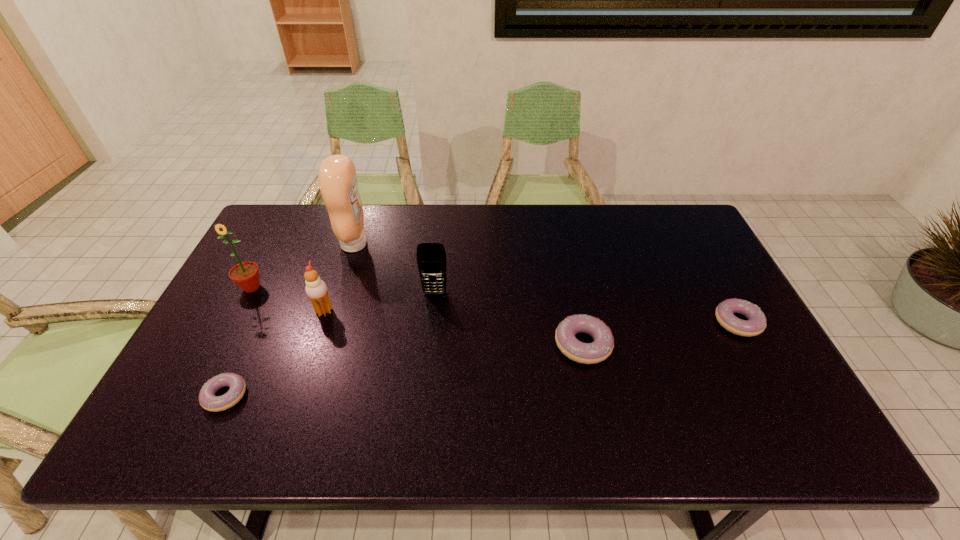
At what (x,y) coordinates should I click in order to perform the action: click on vacant area that lies between the cellular telephone and the tallest object. Please return your answer as a coordinate pair (x, y). The width and height of the screenshot is (960, 540). Looking at the image, I should click on (395, 268).

Where is `vacant point located between the condiment and the second tallest object`? The height and width of the screenshot is (540, 960). vacant point located between the condiment and the second tallest object is located at coordinates (303, 266).

Identify the location of free space between the second shortest object and the third object from right to left. The width and height of the screenshot is (960, 540). (587, 307).

The image size is (960, 540). I want to click on empty space between the nearest object and the sixth shortest object, so click(238, 341).

Locate an element on the screen. This screenshot has width=960, height=540. empty location between the icecream and the second doughnut from left to right is located at coordinates (453, 328).

Where is `free space between the icecream and the farthest object`? The width and height of the screenshot is (960, 540). free space between the icecream and the farthest object is located at coordinates (340, 277).

This screenshot has height=540, width=960. Find the location of `vacant point located between the tallest object and the nearest object`. vacant point located between the tallest object and the nearest object is located at coordinates (290, 320).

The width and height of the screenshot is (960, 540). Find the location of `vacant region between the sixth shortest object and the cellular telephone`. vacant region between the sixth shortest object and the cellular telephone is located at coordinates (343, 290).

Image resolution: width=960 pixels, height=540 pixels. Identify the location of the sixth closest object to the tallest object. (756, 323).

Locate which object ranks second in proximity to the rightmost object. Please provide its 2D coordinates. Your answer should be formatted as a tuple, i.e. [(x, y)], where the tuple contains the x and y coordinates of a point satisfying the conditions above.

[(431, 257)]